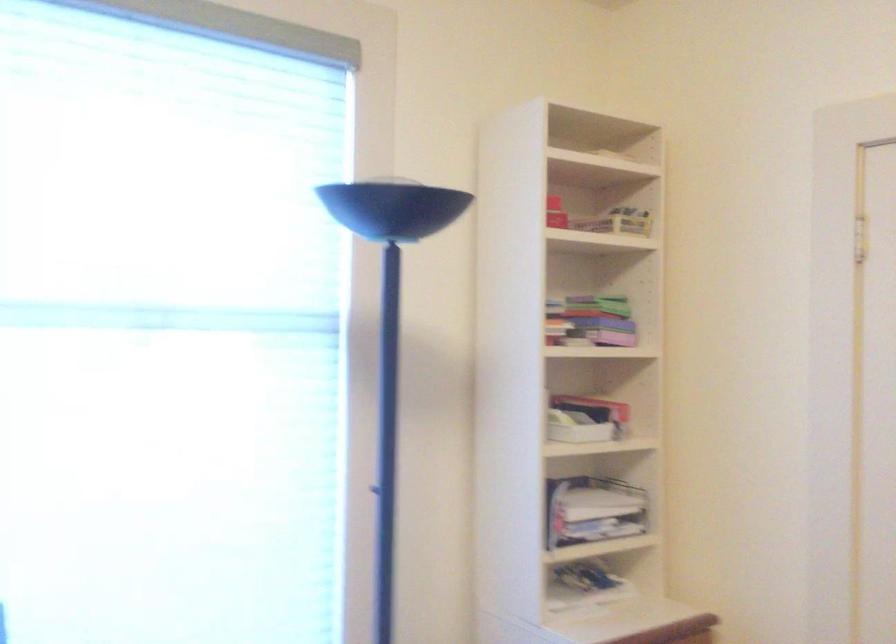
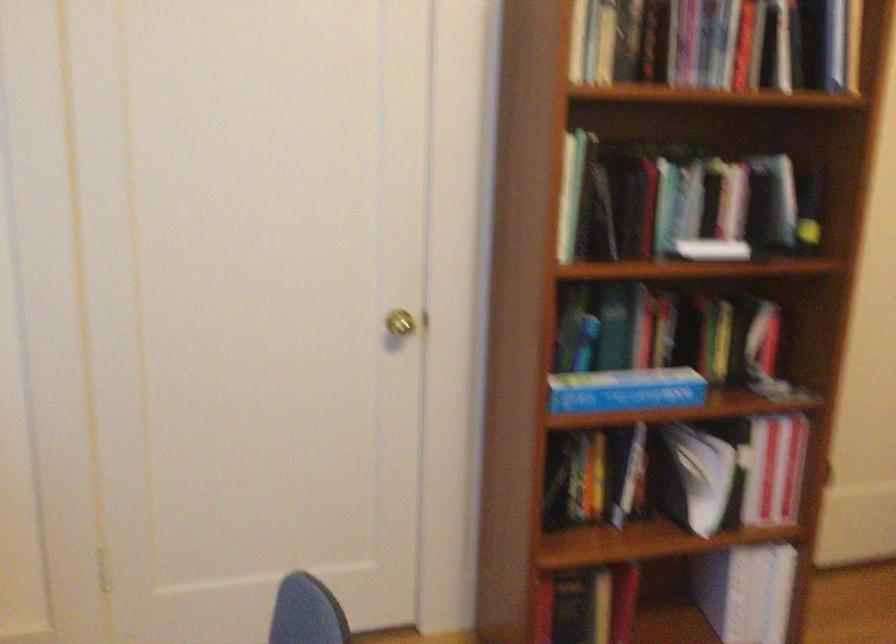
First-person continuous shooting, in which direction is the camera rotating?

The camera rotated toward right-down.